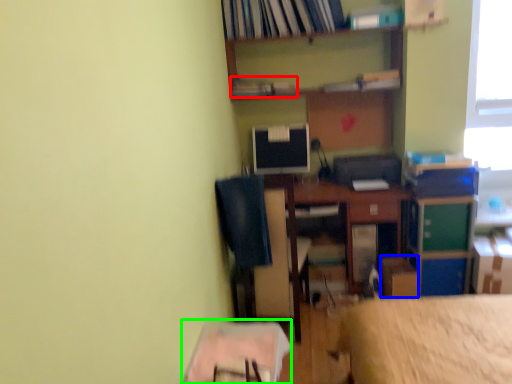
Question: Which object is the closest to the book (highlighted by a red box)? Choose among these: cardboard box (highlighted by a blue box) or table (highlighted by a green box).

Choices:
 (A) cardboard box
 (B) table

Answer: (A)